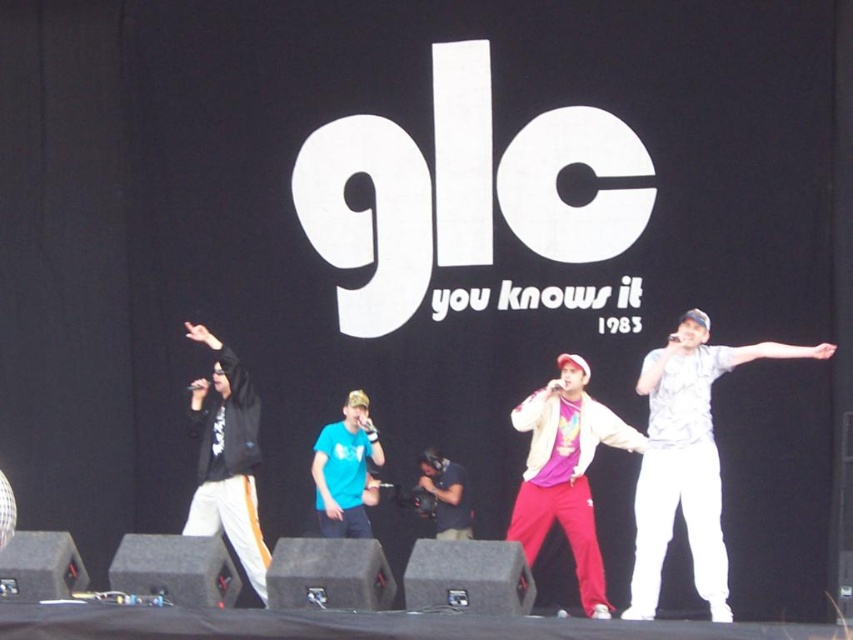
Who is more forward, (x=529, y=490) or (x=334, y=508)?

Positioned in front is point (x=529, y=490).

Between point (552, 499) and point (315, 474), which one is positioned in front?

Point (552, 499)

The image size is (853, 640). I want to click on matte pink shirt at center, so click(x=566, y=472).

Is white cotton shirt at right below matte blue t-shirt at center?

Indeed, white cotton shirt at right is positioned under matte blue t-shirt at center.

Find the location of `white cotton shirt at right`. white cotton shirt at right is located at coordinates (688, 460).

Which is in front, point (721, 589) or point (335, 474)?

Point (721, 589) is in front.

The height and width of the screenshot is (640, 853). I want to click on white cotton shirt at right, so click(688, 460).

How much distance is there between matte pink shirt at center and matte black camera at center?

They are 8.86 feet apart.

Looking at this image, does matte pink shirt at center appear under matte black camera at center?

Actually, matte pink shirt at center is above matte black camera at center.

Which is behind, point (518, 500) or point (457, 508)?

Positioned behind is point (457, 508).

Image resolution: width=853 pixels, height=640 pixels. What are the coordinates of `matte pink shirt at center` in the screenshot? It's located at (566, 472).